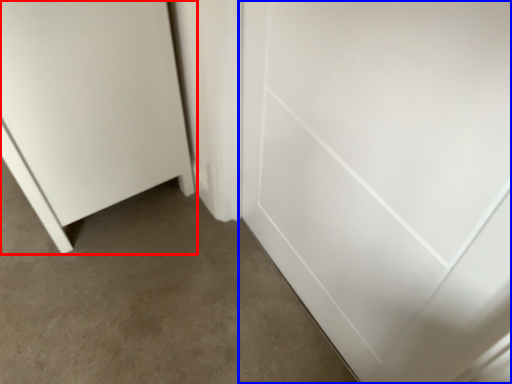
Question: Which object appears farthest to the camera in this image, door (highlighted by a red box) or door (highlighted by a blue box)?

Choices:
 (A) door
 (B) door

Answer: (A)